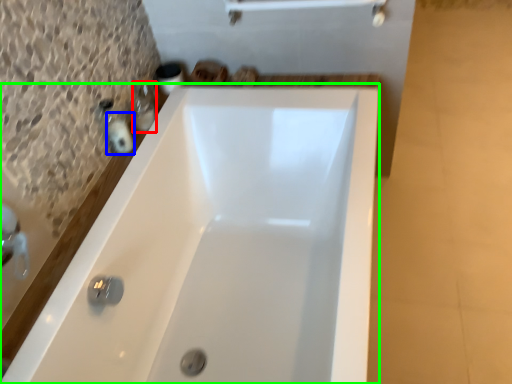
Question: Estimate the real-world distances between objects in this image. Which object is farther from toiletry (highlighted by a red box), toiletry (highlighted by a blue box) or bathtub (highlighted by a green box)?

Choices:
 (A) toiletry
 (B) bathtub

Answer: (B)